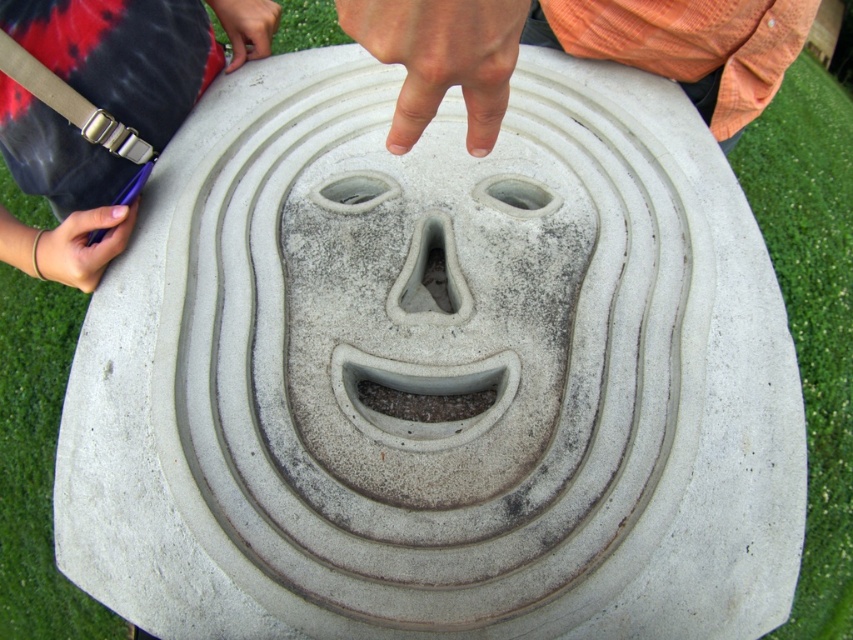
Question: Which object appears farthest from the camera in this image?

Choices:
 (A) tie-dye fabric at left
 (B) matte black hand at upper center

Answer: (B)

Question: Is matte black hand at lower left positioned at the back of matte black hand at upper center?

Choices:
 (A) no
 (B) yes

Answer: (A)

Question: Does orange cotton shirt at upper center have a greater width compared to matte black hand at upper center?

Choices:
 (A) yes
 (B) no

Answer: (A)

Question: Which of the following is the farthest from the observer?

Choices:
 (A) (59, 236)
 (B) (103, 186)

Answer: (B)

Question: Estimate the real-world distances between objects in this image. Which object is closer to the matte black hand at upper center?

Choices:
 (A) white matte finger at center
 (B) matte black hand at lower left
 (C) tie-dye fabric at left

Answer: (C)

Question: Is matte black hand at lower left thinner than matte black hand at upper center?

Choices:
 (A) no
 (B) yes

Answer: (A)